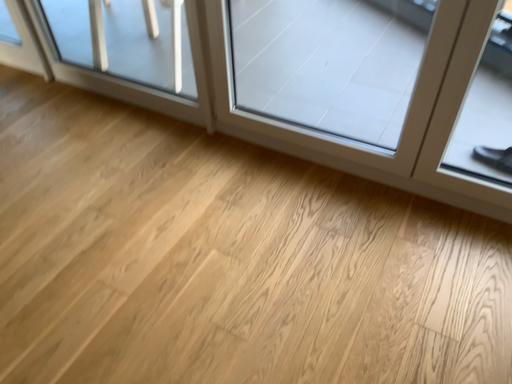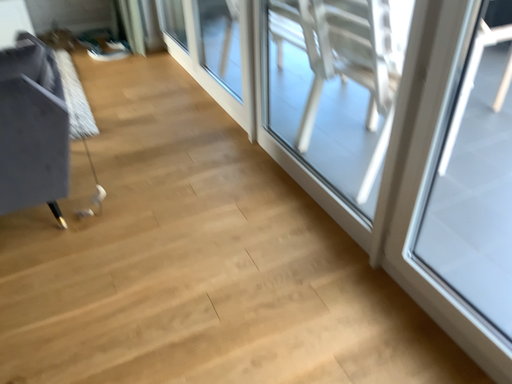
Question: Which way did the camera rotate in the video?

Choices:
 (A) rotated left
 (B) rotated right

Answer: (A)